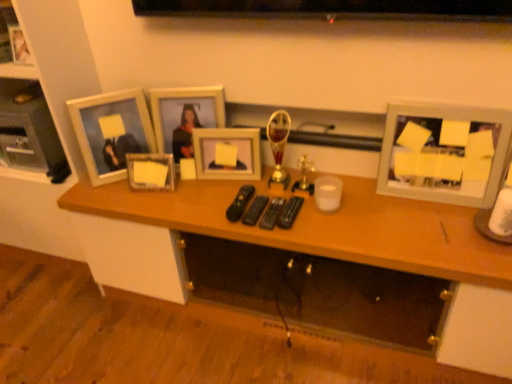
Locate an element on the screen. The image size is (512, 384). vacant space in front of wooden picture frame at center, which is the third picture frame in left-to-right order is located at coordinates (156, 203).